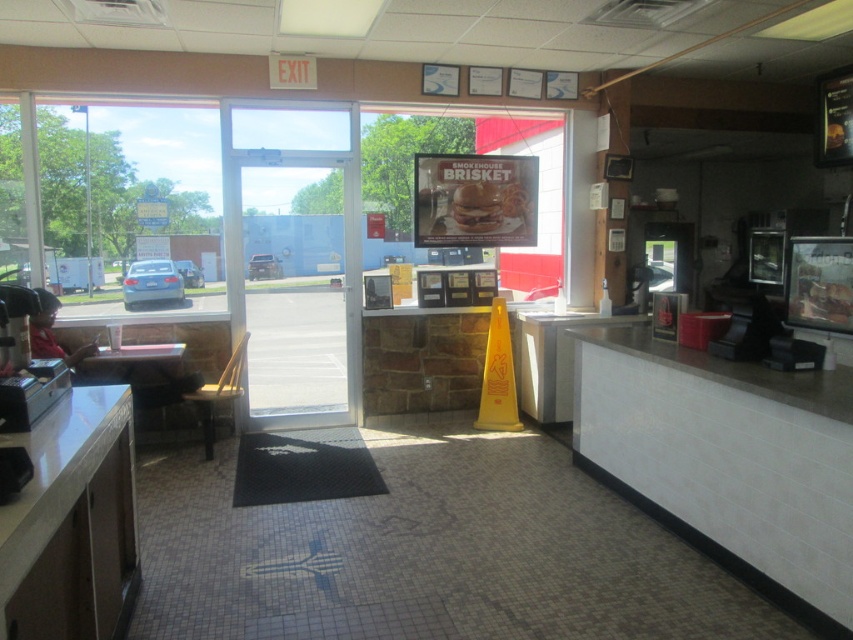
You are standing at the entrance of the fast food restaurant and want to walk to the table with a pink surface outside the window. There are two points marked on the floor as point 1 at coordinates point (334, 232) and point 2 at coordinates point (462, 198). Which point should you step on first while moving towards the table?

You should step on point 2 at coordinates point (462, 198) first because point 1 at coordinates point (334, 232) is behind it, meaning point 2 is closer to your starting position at the entrance.